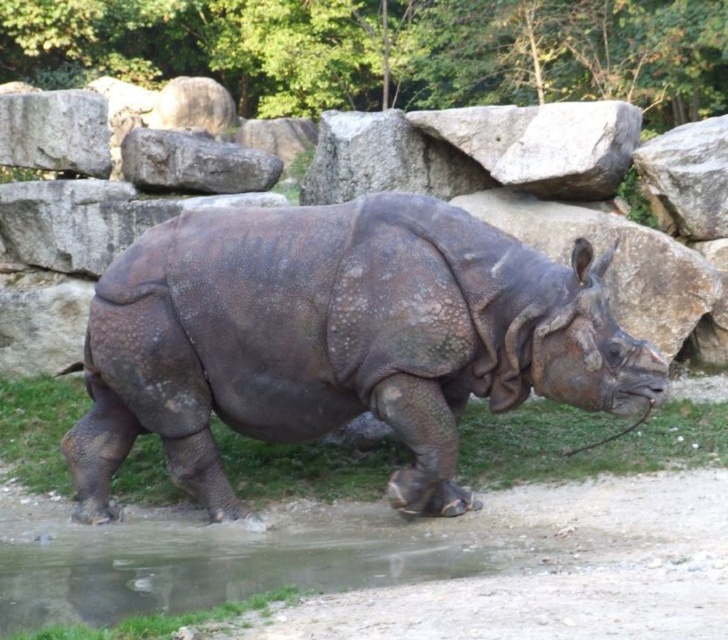
Which is below, dark brown textured rhinoceros at center or transparent wet ground at lower center?

Positioned lower is transparent wet ground at lower center.

Between dark brown textured rhinoceros at center and transparent wet ground at lower center, which one appears on the right side from the viewer's perspective?

From the viewer's perspective, dark brown textured rhinoceros at center appears more on the right side.

Does point (456, 403) come closer to viewer compared to point (347, 538)?

That is False.

Locate an element on the screen. The width and height of the screenshot is (728, 640). dark brown textured rhinoceros at center is located at coordinates (336, 340).